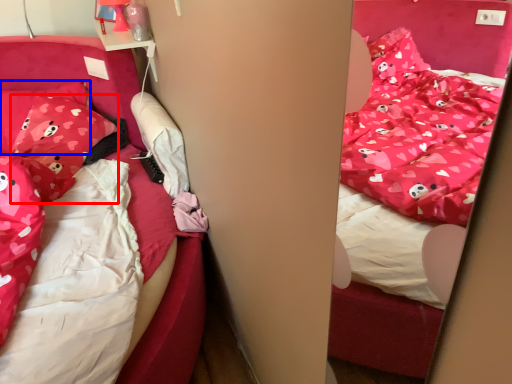
Question: Which of the following is the closest to the observer, pillow (highlighted by a red box) or pillow (highlighted by a blue box)?

Choices:
 (A) pillow
 (B) pillow

Answer: (A)